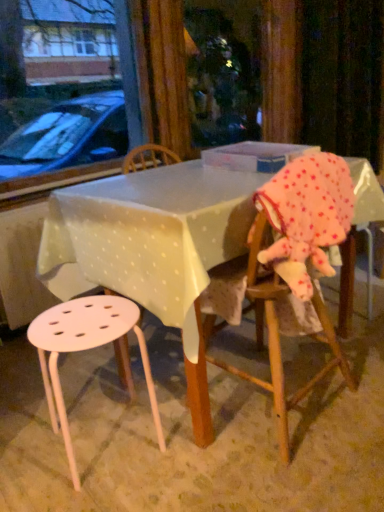
The width and height of the screenshot is (384, 512). What are the coordinates of `vacant area that lies between white plastic stool at lower left and wooden chair at right` in the screenshot? It's located at 185,436.